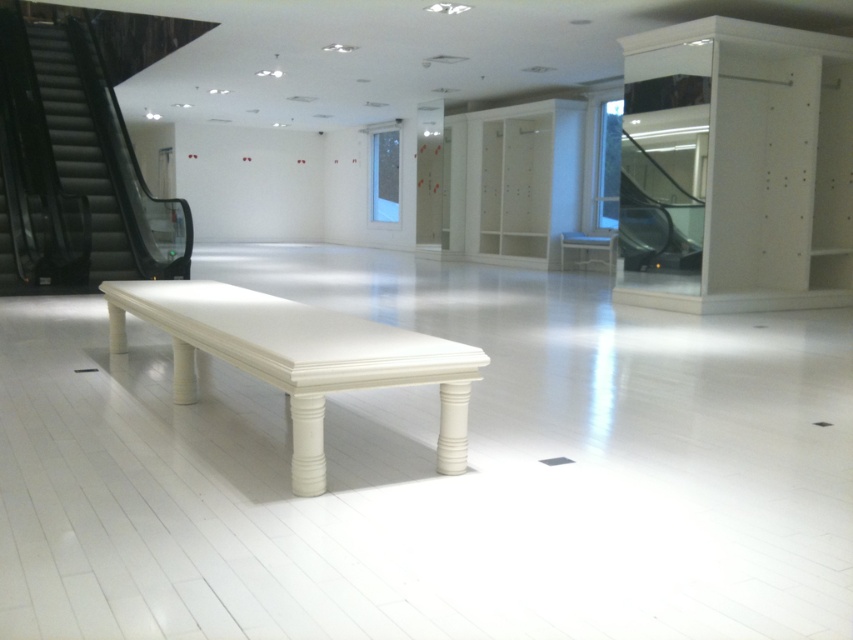
You are standing in the shopping mall and want to take a break. You see the white glossy bench at center and the metallic glass escalator at right. Which object is nearer to you?

The white glossy bench at center is closer to the viewer than the metallic glass escalator at right, so the bench is nearer to you.

You are a customer in the mall and want to sit down. You see the white glossy bench at center and the metallic glass escalator at right. Which object is closer to the entrance if the entrance is located to the left side of the scene?

The white glossy bench at center is closer to the entrance because it is positioned to the left of the metallic glass escalator at right, and the entrance is on the left side of the scene.